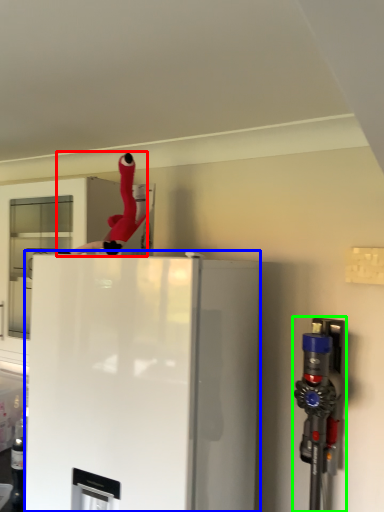
Question: Based on their relative distances, which object is farther from person (highlighted by a red box)? Choose from refrigerator (highlighted by a blue box) and appliance (highlighted by a green box).

Choices:
 (A) refrigerator
 (B) appliance

Answer: (B)